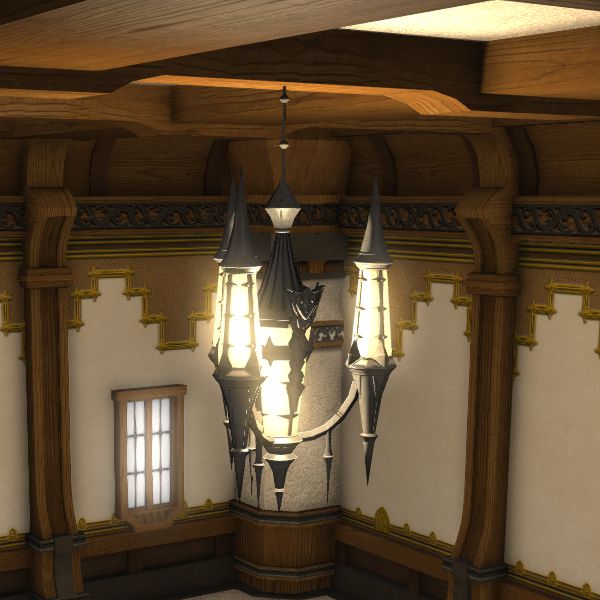
The width and height of the screenshot is (600, 600). I want to click on ceiling beam, so click(179, 42), click(438, 68), click(559, 66), click(237, 108), click(143, 109).